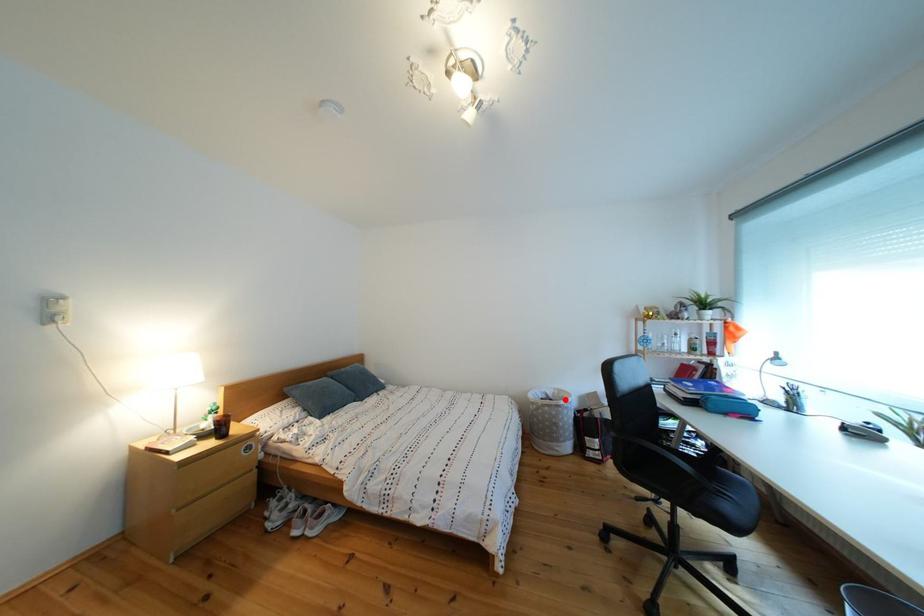
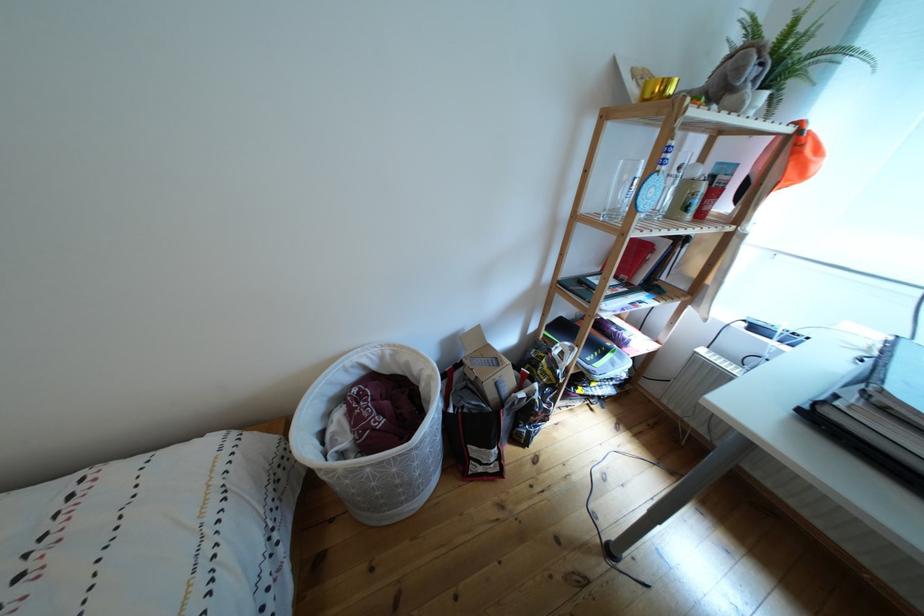
The point at the highlighted location is marked in the first image. Where is the corresponding point in the second image?

(393, 363)